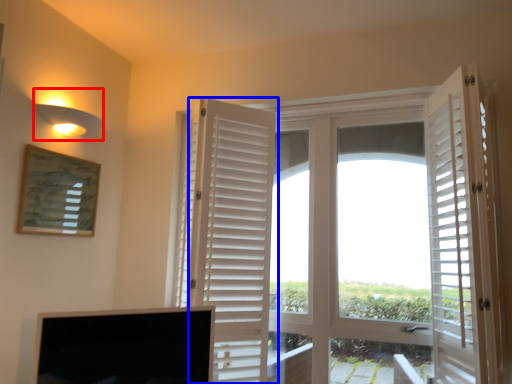
Question: Which object appears closest to the camera in this image, light fixture (highlighted by a red box) or door (highlighted by a blue box)?

Choices:
 (A) light fixture
 (B) door

Answer: (B)